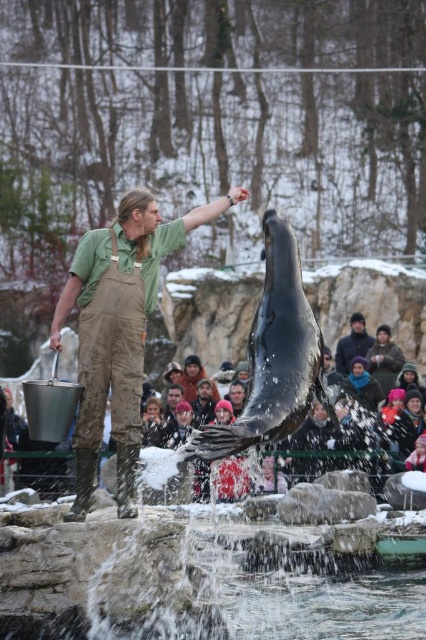
You are standing at the edge of the rocky platform watching the sea lion show. There are two points marked in the scene. Which point, point (129, 301) or point (23, 378), is closer to you?

Point (129, 301) is closer to the viewer than point (23, 378).

Consider the image. You are a photographer trying to capture the interaction between the green cotton shirt at center and the matte brown fur at center. Which object should you focus on first to ensure it appears in the foreground of your photo?

The green cotton shirt at center is positioned over matte brown fur at center, so you should focus on the green cotton shirt at center first to ensure it appears in the foreground.